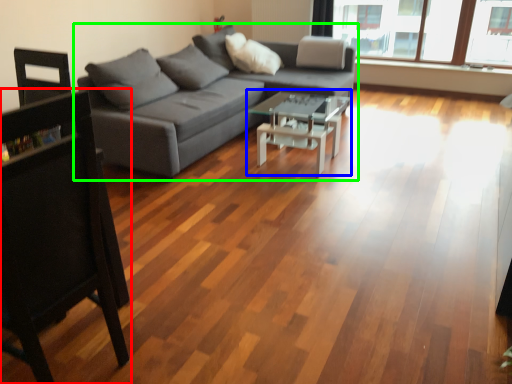
Question: Which object is the farthest from chair (highlighted by a red box)? Choose among these: coffee table (highlighted by a blue box) or studio couch (highlighted by a green box).

Choices:
 (A) coffee table
 (B) studio couch

Answer: (A)